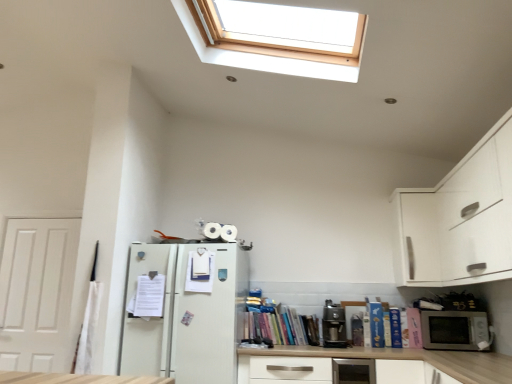
Find the location of a particular element. blank space situated above white matte door at left (from a real-world perspective) is located at coordinates (42, 219).